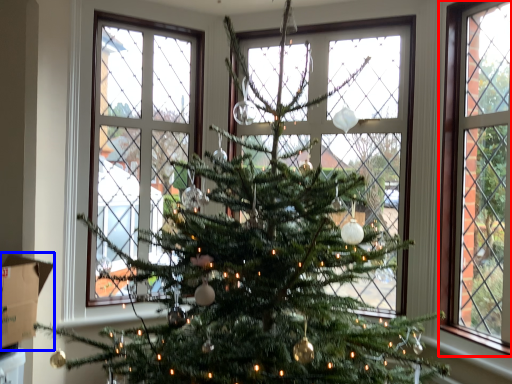
Question: Which point is further to the camera, window (highlighted by a red box) or cardboard box (highlighted by a blue box)?

Choices:
 (A) window
 (B) cardboard box

Answer: (A)